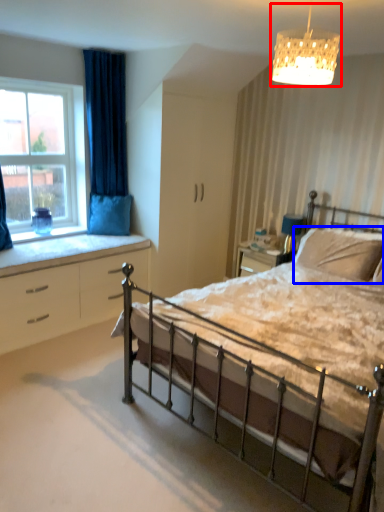
Question: Which object appears farthest to the camera in this image, lamp (highlighted by a red box) or pillow (highlighted by a blue box)?

Choices:
 (A) lamp
 (B) pillow

Answer: (B)